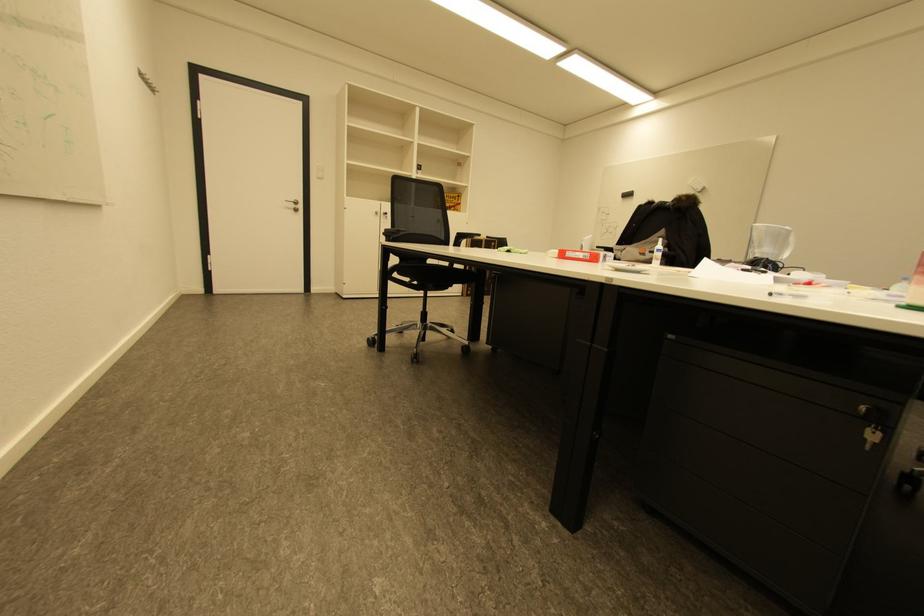
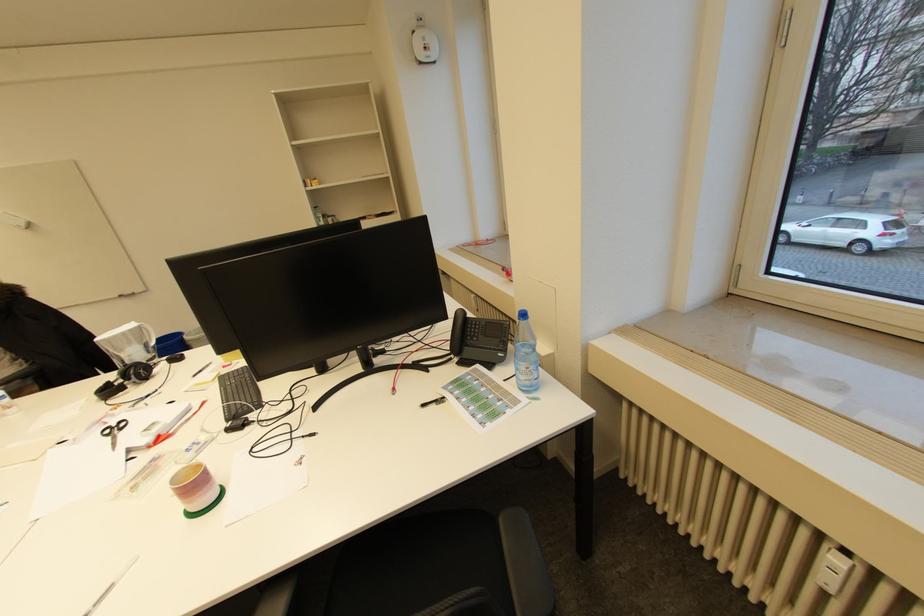
Locate, in the second image, the point that corresponds to (768,264) in the first image.

(140, 377)